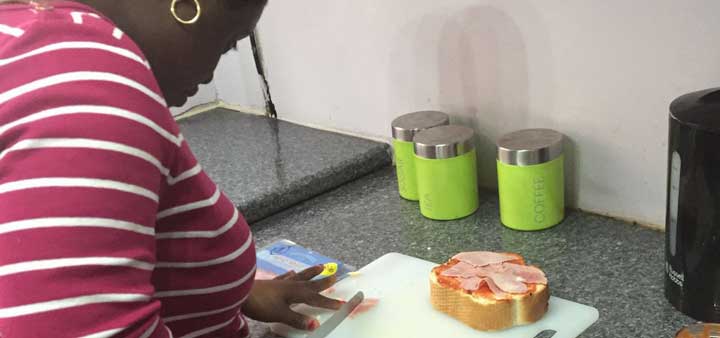
I want to click on white cutting board, so click(408, 318).